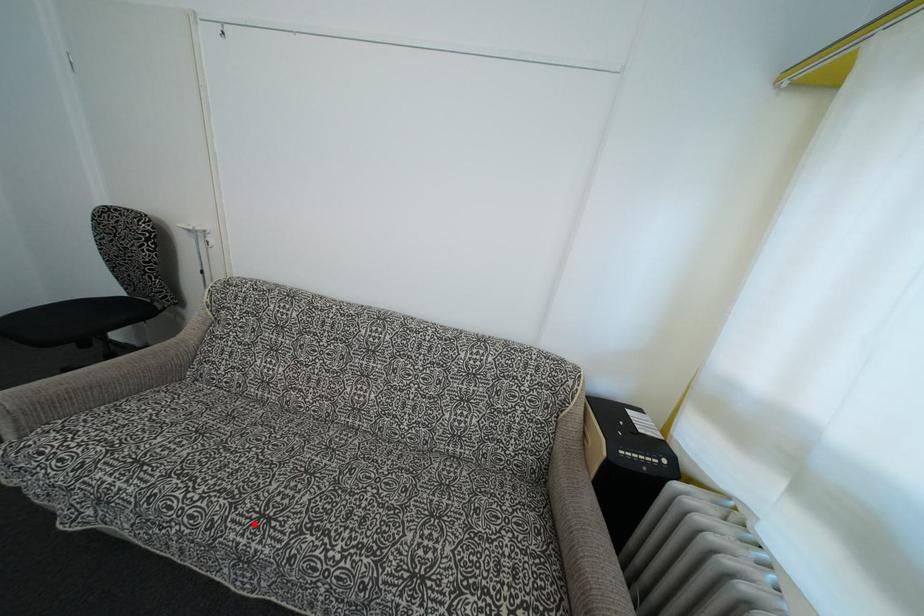
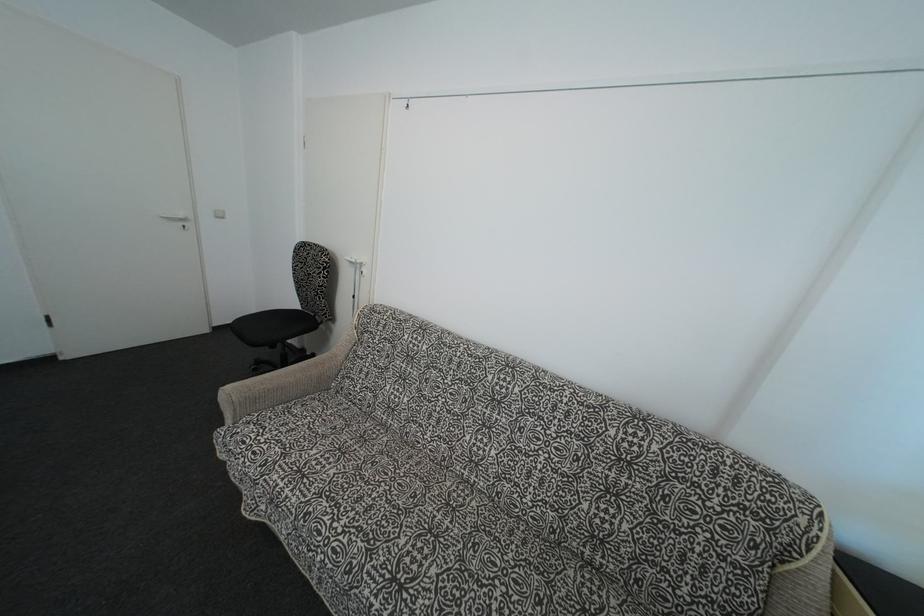
Find the pixel in the second image that matches the highlighted location in the first image.

(387, 583)